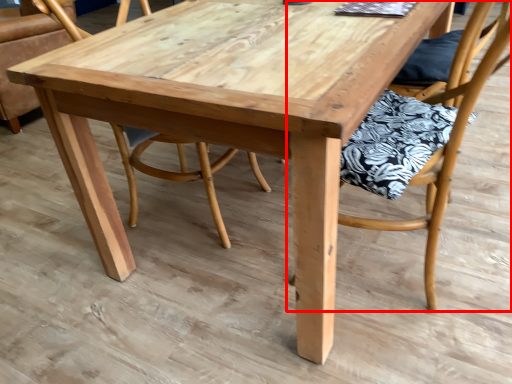
Question: From the image's perspective, where is chair (annotated by the red box) located relative to chair?

Choices:
 (A) below
 (B) above

Answer: (A)